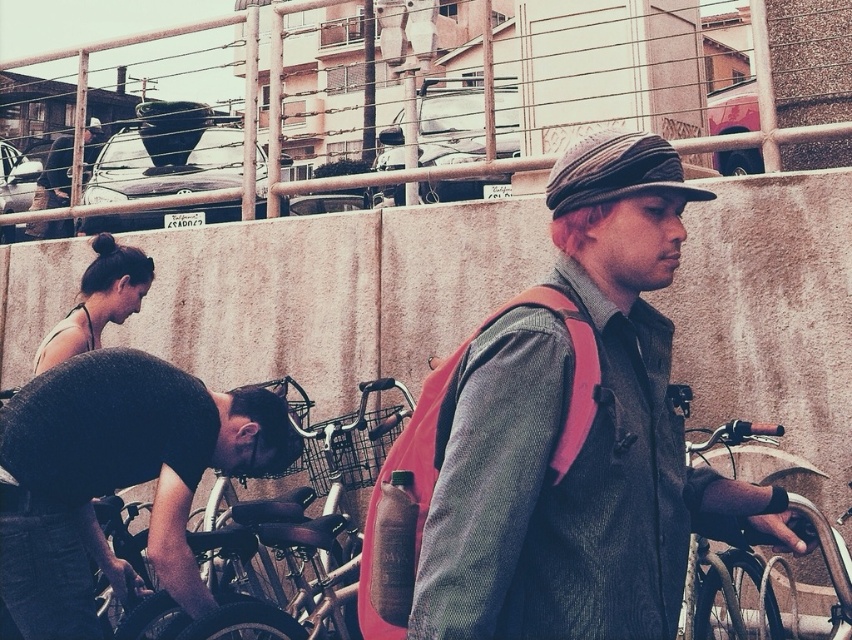
Based on the photo, you are a delivery person who needs to quickly locate your two backpacks in the scene. Which backpack is closer to you, the matte pink backpack at center or the matte black backpack at upper left?

The matte pink backpack at center is closer to you because it is in front of the matte black backpack at upper left.

You are a delivery person who needs to choose a backpack to carry your items. You have two options in the scene, the matte pink backpack at center and the matte black backpack at upper left. Which one has a bigger capacity?

The matte pink backpack at center has a larger size compared to the matte black backpack at upper left, so it has a bigger capacity.